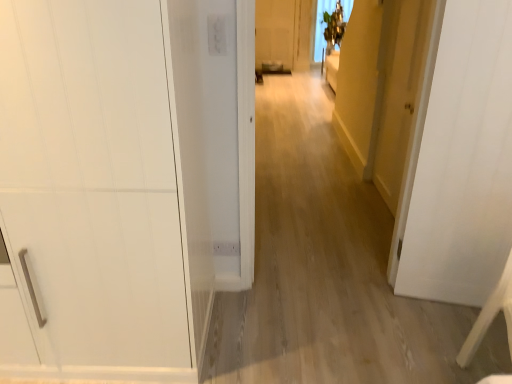
Question: Is point (493, 291) positioned closer to the camera than point (98, 120)?

Choices:
 (A) farther
 (B) closer

Answer: (A)

Question: Is white wood chair at lower right wider or thinner than white matte cabinet at left, the 3th door in the right-to-left sequence?

Choices:
 (A) wide
 (B) thin

Answer: (B)

Question: Which object is the closest to the yellow matte door at right, marked as the 3th door in a left-to-right arrangement?

Choices:
 (A) white wood chair at lower right
 (B) white matte door at center, marked as the second door in a left-to-right arrangement
 (C) white matte cabinet at left, acting as the first door starting from the left

Answer: (B)

Question: Which of these objects is positioned closest to the white matte door at center, the second door viewed from the right?

Choices:
 (A) white wood chair at lower right
 (B) white matte cabinet at left, the 3th door in the right-to-left sequence
 (C) yellow matte door at right, the first door when ordered from right to left

Answer: (A)